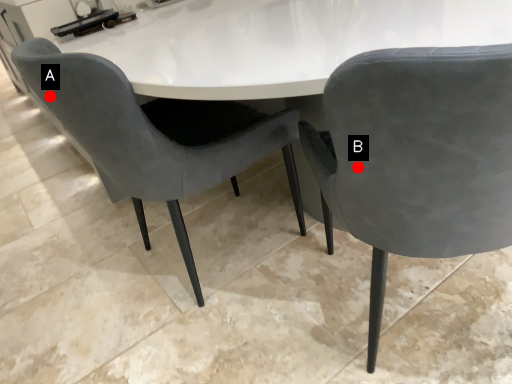
Question: Two points are circled on the image, labeled by A and B beside each circle. Which point appears farthest from the camera in this image?

Choices:
 (A) A is further
 (B) B is further

Answer: (A)